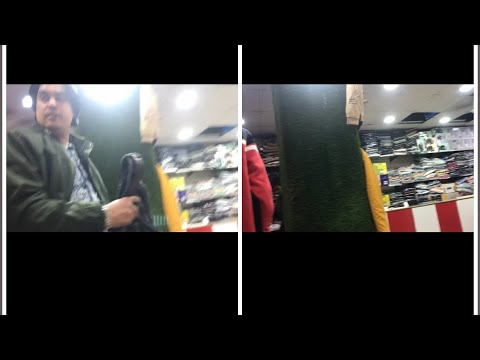
This screenshot has height=360, width=480. What are the coordinates of `shelves` in the screenshot? It's located at (413, 146), (412, 174), (417, 199).